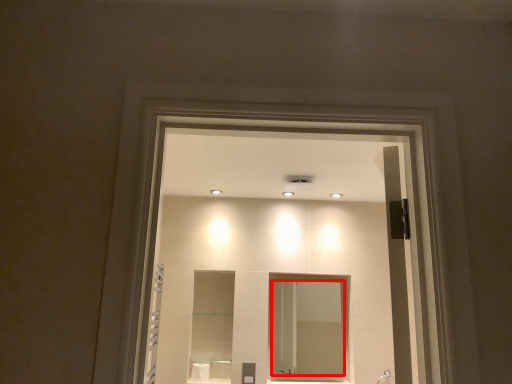
Question: From the image's perspective, where is mirror (annotated by the red box) located relative to shower?

Choices:
 (A) above
 (B) below

Answer: (A)